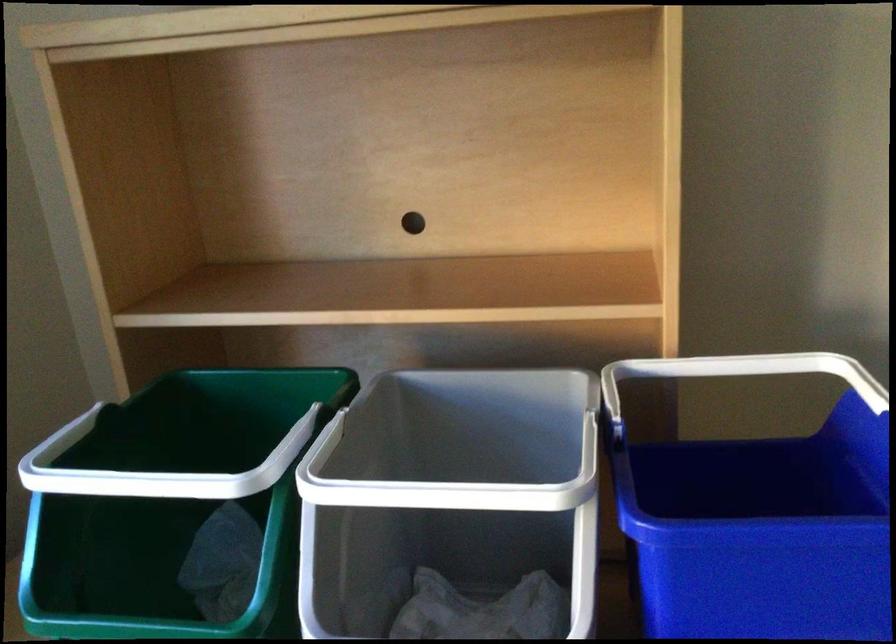
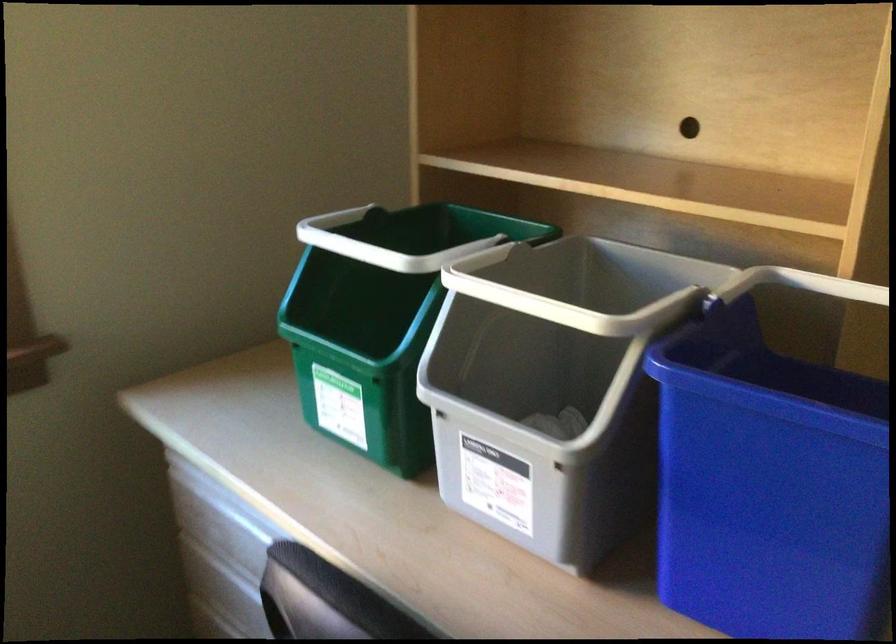
Question: The camera is either moving clockwise (left) or counter-clockwise (right) around the object. The first image is from the beginning of the video and the second image is from the end. Is the camera moving left or right when shooting the video?

Choices:
 (A) Left
 (B) Right

Answer: (B)